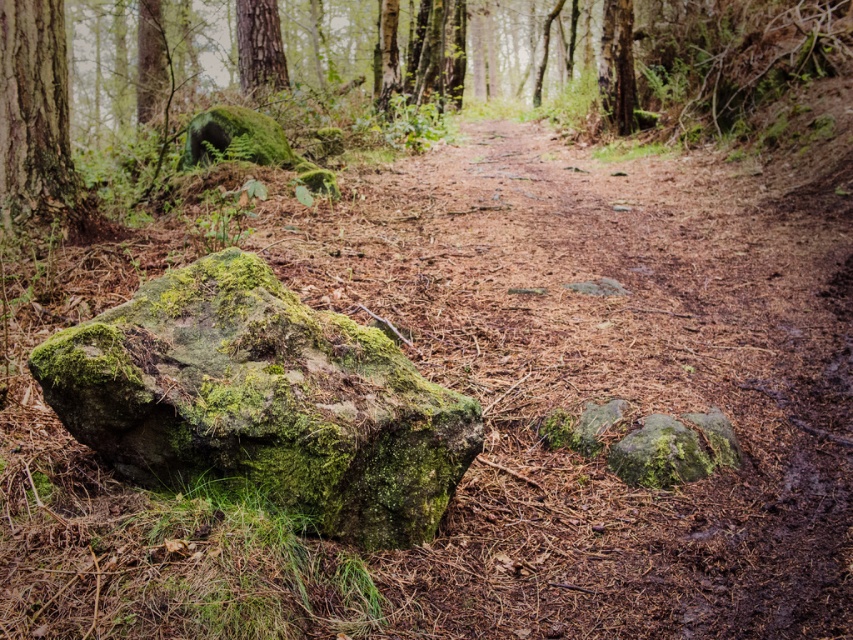
You are standing at the center of the dirt path in the forest scene. You want to move towards the green mossy rock at left. Which direction should you head?

The green mossy rock at left is located at point coordinates, so you should head to the left direction to reach it.

You are a hiker who wants to take a photo of the green mossy rock at left and the smooth bark tree trunk at left. Which object should you aim your camera at first if you want to capture both in a single frame without moving the camera?

You should aim your camera at the green mossy rock at left first because it is located below the smooth bark tree trunk at left, so adjusting the framing to include both would require ensuring the lower object is within the camera view before the upper one.